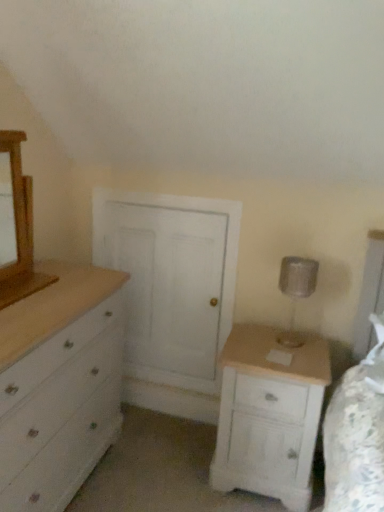
Question: Considering the relative sizes of white wood nightstand at lower right and silver metallic table lamp at right in the image provided, is white wood nightstand at lower right bigger than silver metallic table lamp at right?

Choices:
 (A) no
 (B) yes

Answer: (B)

Question: Are white wood nightstand at lower right and silver metallic table lamp at right making contact?

Choices:
 (A) no
 (B) yes

Answer: (A)

Question: Does white wood nightstand at lower right have a lesser width compared to silver metallic table lamp at right?

Choices:
 (A) no
 (B) yes

Answer: (A)

Question: Can you confirm if white wood nightstand at lower right is taller than silver metallic table lamp at right?

Choices:
 (A) no
 (B) yes

Answer: (B)

Question: Is white wood nightstand at lower right positioned beyond the bounds of silver metallic table lamp at right?

Choices:
 (A) yes
 (B) no

Answer: (A)

Question: Considering the positions of wooden medicine cabinet at left and white wood nightstand at lower right in the image, is wooden medicine cabinet at left wider or thinner than white wood nightstand at lower right?

Choices:
 (A) thin
 (B) wide

Answer: (A)

Question: Is wooden medicine cabinet at left inside the boundaries of white wood nightstand at lower right, or outside?

Choices:
 (A) inside
 (B) outside

Answer: (B)

Question: Visually, is wooden medicine cabinet at left positioned to the left or to the right of white wood nightstand at lower right?

Choices:
 (A) right
 (B) left

Answer: (B)

Question: From a real-world perspective, is wooden medicine cabinet at left positioned above or below white wood nightstand at lower right?

Choices:
 (A) above
 (B) below

Answer: (A)

Question: From their relative heights in the image, would you say white wood nightstand at lower right is taller or shorter than white painted wood chest of drawers at left?

Choices:
 (A) tall
 (B) short

Answer: (B)

Question: Is white wood nightstand at lower right wider or thinner than white painted wood chest of drawers at left?

Choices:
 (A) wide
 (B) thin

Answer: (B)

Question: From the image's perspective, is white wood nightstand at lower right positioned above or below white painted wood chest of drawers at left?

Choices:
 (A) below
 (B) above

Answer: (A)

Question: Which is correct: white wood nightstand at lower right is inside white painted wood chest of drawers at left, or outside of it?

Choices:
 (A) outside
 (B) inside

Answer: (A)

Question: Looking at their shapes, would you say wooden medicine cabinet at left is wider or thinner than white painted wood chest of drawers at left?

Choices:
 (A) wide
 (B) thin

Answer: (B)

Question: Relative to white painted wood chest of drawers at left, is wooden medicine cabinet at left in front or behind?

Choices:
 (A) front
 (B) behind

Answer: (B)